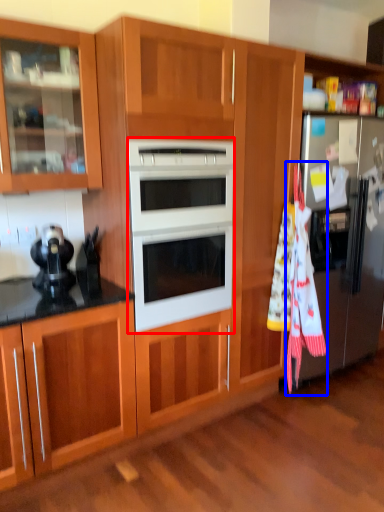
Question: Which point is closer to the camera, microwave oven (highlighted by a red box) or beach towel (highlighted by a blue box)?

Choices:
 (A) microwave oven
 (B) beach towel

Answer: (A)